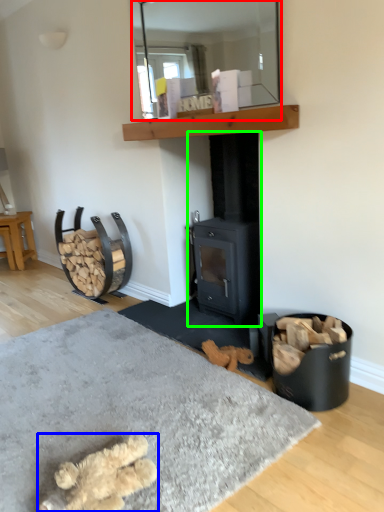
Question: Which object is the farthest from mirror (highlighted by a red box)? Choose among these: animal (highlighted by a blue box) or wood burning stove (highlighted by a green box).

Choices:
 (A) animal
 (B) wood burning stove

Answer: (A)